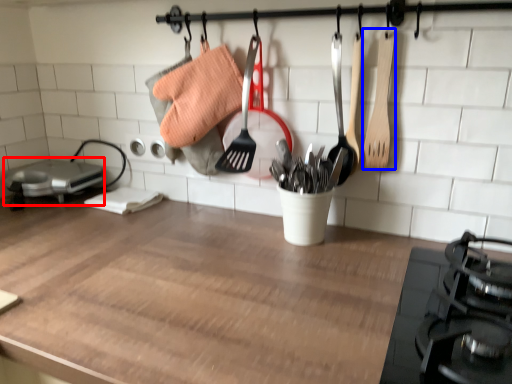
Question: Which point is further to the camera, appliance (highlighted by a red box) or spatula (highlighted by a blue box)?

Choices:
 (A) appliance
 (B) spatula

Answer: (A)